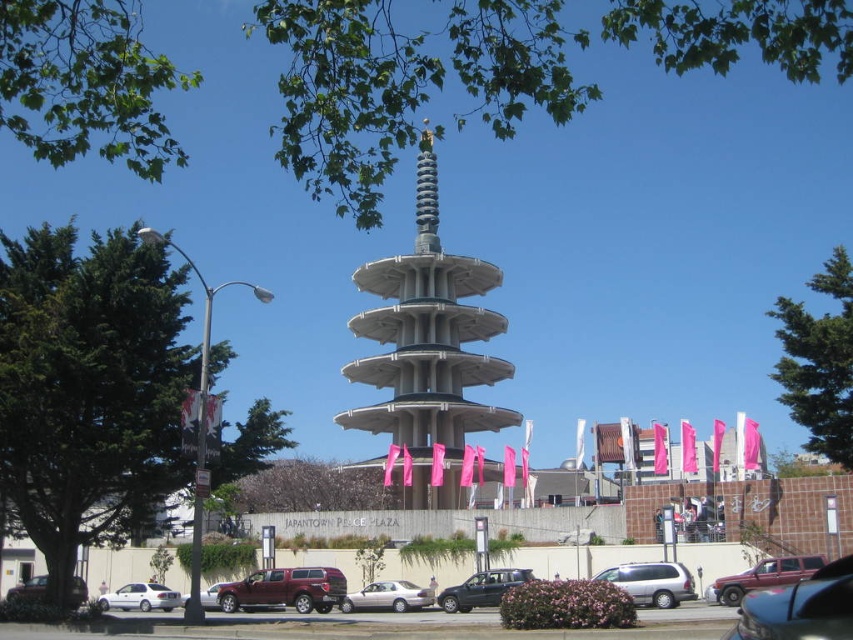
You are a photographer trying to capture the entire view of the satin silver spire at center and the matte black car at center in one shot. Based on their sizes, which object should you focus on to ensure both are fully visible in the frame?

The satin silver spire at center might be wider than the matte black car at center, so focusing on the spire would ensure both are visible as it occupies more space.

You are standing at the lamppost near the left side of the parking area and want to walk towards the golden statue at the peak of the pagoda. Which of the two points, point A at coordinates point (409, 344) or point B at coordinates point (167, 609), would you pass through first on your path?

You would pass through point B at coordinates point (167, 609) first because point A at coordinates point (409, 344) is behind it in your path towards the golden statue.